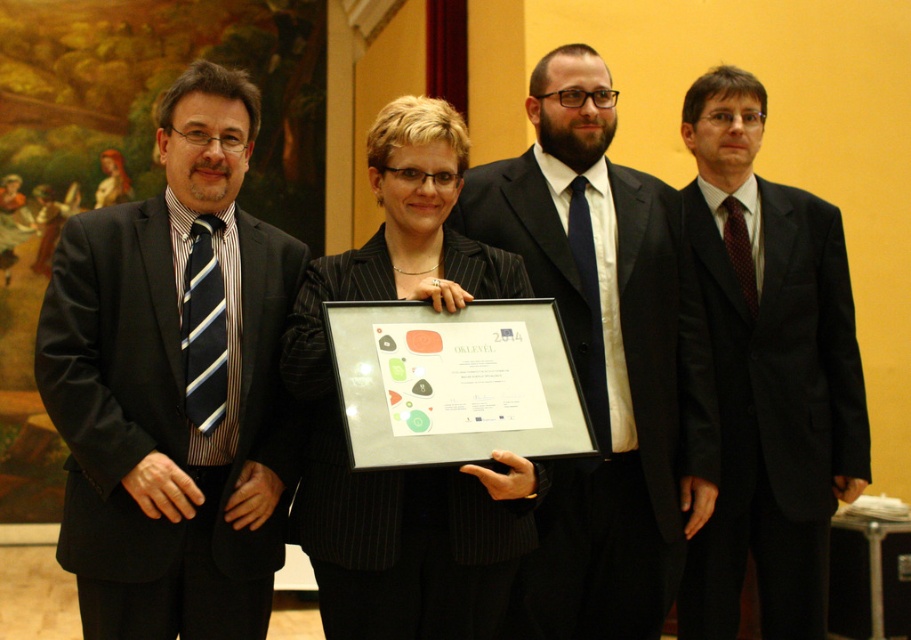
You are a photographer at a formal event. You need to capture a group photo of the matte black suit at left and the black pinstripe suit at center. The camera you are using has a minimum focusing distance of 24 inches. Will you be able to take the photo without moving either of the subjects?

The distance between the matte black suit at left and the black pinstripe suit at center is 23.49 inches, which is less than the camera minimum focusing distance of 24 inches. Therefore, you will not be able to take the photo without moving either of the subjects.

You are a photographer at this event. You need to position two individuals wearing the matte black suit at left and the black satin suit at right so that both can be clearly seen in the photo. Which person should stand closer to the camera to ensure their full height is captured without cropping?

The matte black suit at left is taller than the black satin suit at right. To ensure both are fully visible, the person in the black satin suit at right should stand closer to the camera so their shorter height doesn

Where is the matte black suit at left in the image?

The matte black suit at left is located at point 0.602 on the horizontal axis and 0.192 on the vertical axis.